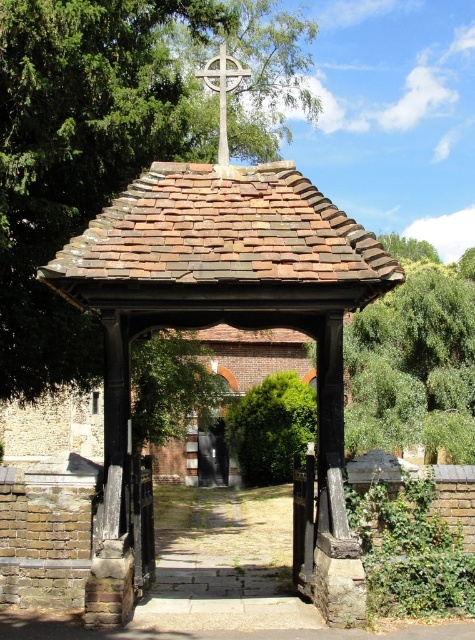
Question: Among these objects, which one is farthest from the camera?

Choices:
 (A) white stone cross at upper center
 (B) green leafy tree at center
 (C) brown tiled gazebo at center

Answer: (B)

Question: In this image, where is brown tiled gazebo at center located relative to green leafy tree at center?

Choices:
 (A) right
 (B) left

Answer: (A)

Question: Among these objects, which one is farthest from the camera?

Choices:
 (A) white stone cross at upper center
 (B) brown tiled gazebo at center

Answer: (A)

Question: Is brown tiled gazebo at center positioned in front of white stone cross at upper center?

Choices:
 (A) no
 (B) yes

Answer: (B)

Question: Is brown tiled gazebo at center thinner than green leafy tree at center?

Choices:
 (A) no
 (B) yes

Answer: (B)

Question: Which point is closer to the camera taking this photo?

Choices:
 (A) coord(324,538)
 (B) coord(54,150)
 (C) coord(208,81)

Answer: (A)